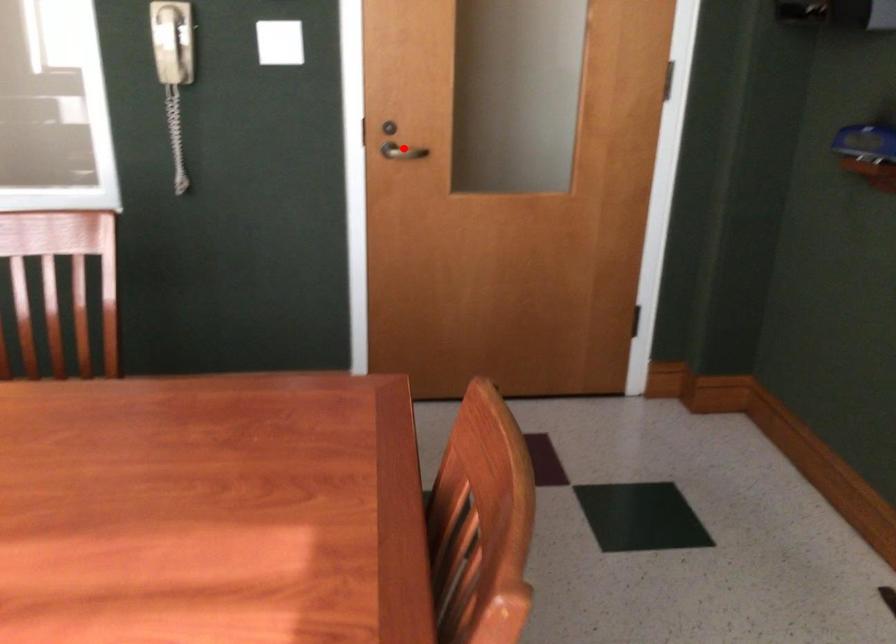
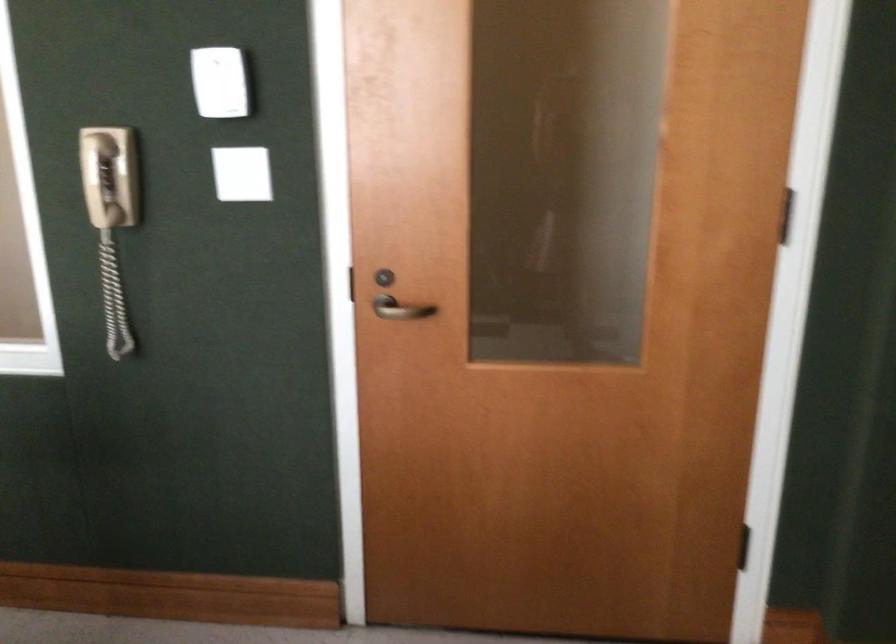
Where in the second image is the point corresponding to the highlighted location from the first image?

(401, 308)